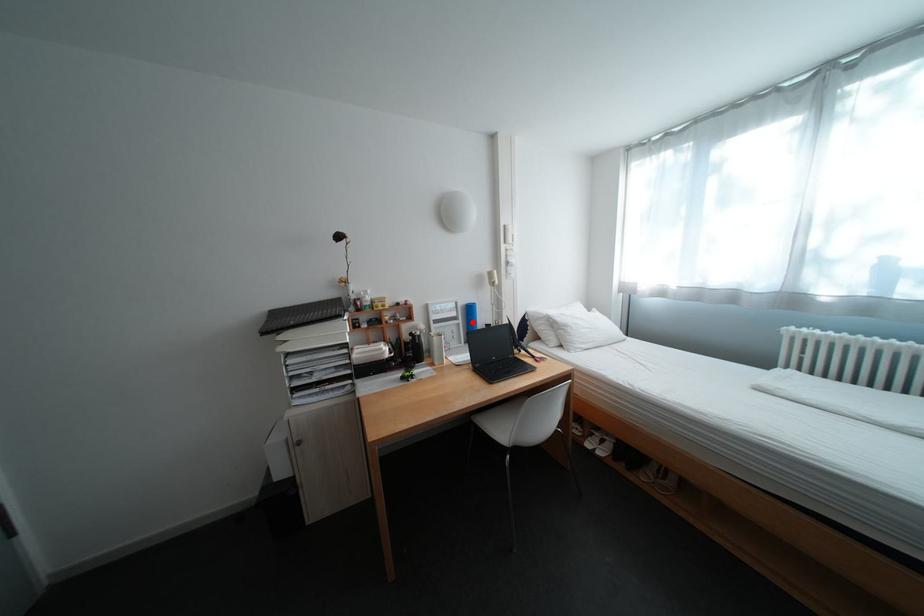
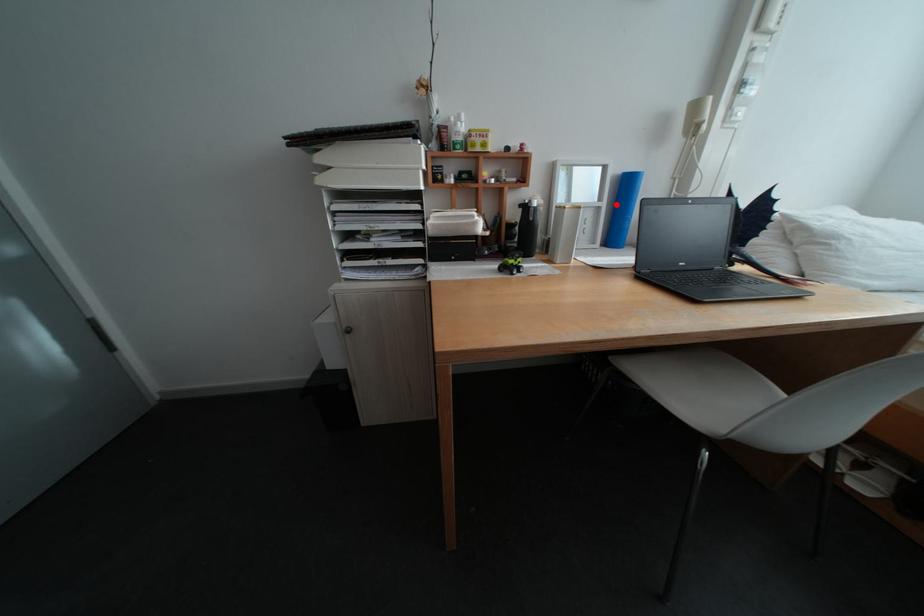
I am providing you with two images of the same scene from different viewpoints. A red point is marked on the first image and another point is marked on the second image. Does the point marked in image1 correspond to the same location as the one in image2?

Yes